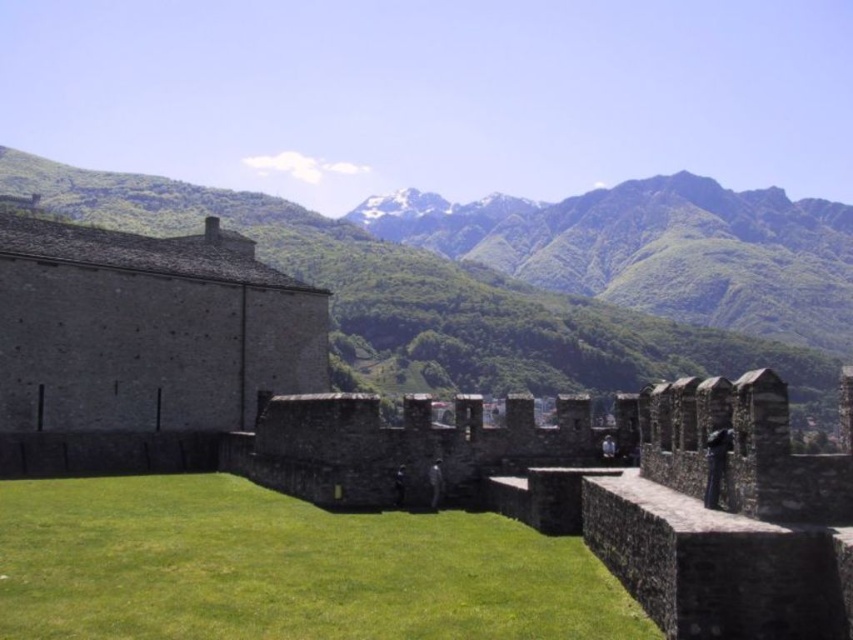
You are standing at the origin point in the image. Which direction should you move to reach the green grass at center?

The green grass at center is located at coordinates approximately 0.889 on the x axis and 0.334 on the y axis, so you should move towards the right and slightly upwards from the origin point to reach it.

You are a gardener tasked with maintaining the green grass at center and the brown stone wall at center within the historic site. Considering their sizes, which area would require more effort to mow the grass?

The green grass at center has a smaller size compared to the brown stone wall at center, so the green grass at center would require less effort to mow since it is smaller in area.

You are standing in the courtyard surrounded by the historic stone wall and looking towards the mountains. You notice the green grass at center and the green leafy mountain at upper center. Which of these two has a smaller width when viewed from your current position?

The green grass at center has a smaller width than the green leafy mountain at upper center.